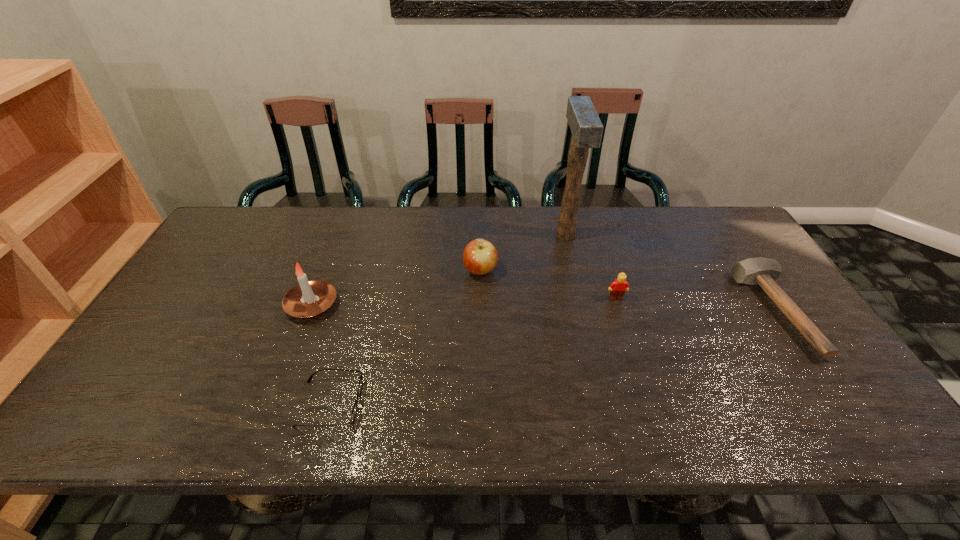
The image size is (960, 540). What are the coordinates of `empty space that is in between the second tallest object and the taller mallet` in the screenshot? It's located at (439, 270).

At what (x,y) coordinates should I click in order to perform the action: click on vacant area that lies between the nearest object and the candle. Please return your answer as a coordinate pair (x, y). This screenshot has height=540, width=960. Looking at the image, I should click on (322, 354).

Identify which object is the nearest to the shorter mallet. Please provide its 2D coordinates. Your answer should be formatted as a tuple, i.e. [(x, y)], where the tuple contains the x and y coordinates of a point satisfying the conditions above.

[(618, 287)]

At what (x,y) coordinates should I click in order to perform the action: click on object that is the third closest one to the taller mallet. Please return your answer as a coordinate pair (x, y). The height and width of the screenshot is (540, 960). Looking at the image, I should click on [x=763, y=271].

You are a GUI agent. You are given a task and a screenshot of the screen. Output one action in this format:
    pyautogui.click(x=<x>, y=<y>)
    Task: Click on the vacant space that satisfies the following two spatial constraints: 1. on the face of the Lego; 2. on the front-facing side of the shortest object
    The width and height of the screenshot is (960, 540).
    Given the screenshot: What is the action you would take?
    pyautogui.click(x=650, y=404)

What are the coordinates of `free point that satisfies the following two spatial constraints: 1. on the face of the fifth object from left to right; 2. on the right side of the shorter mallet` in the screenshot? It's located at (620, 311).